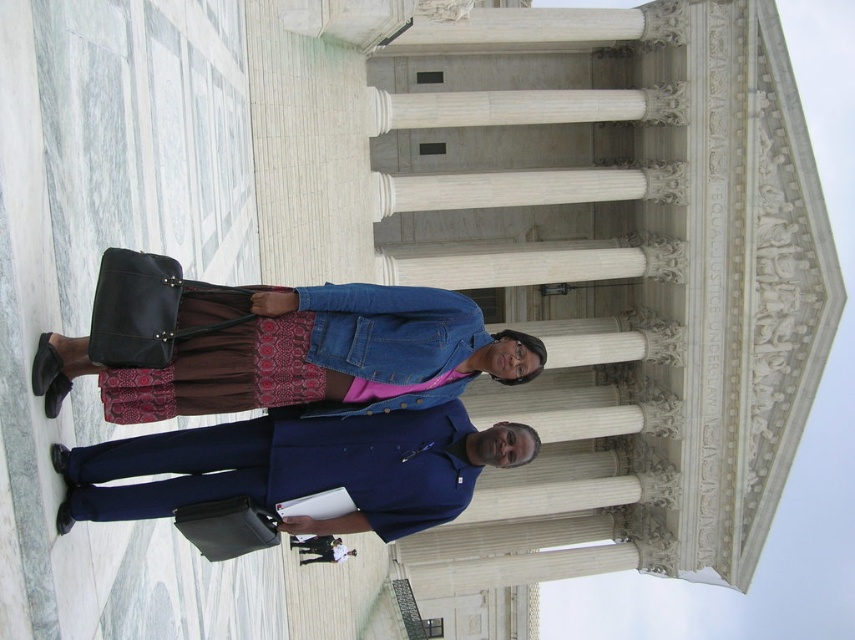
Consider the image. Can you confirm if denim jacket at center is thinner than dark blue shirt at center?

In fact, denim jacket at center might be wider than dark blue shirt at center.

Which is behind, point (497, 339) or point (305, 547)?

Positioned behind is point (305, 547).

Is point (276, 358) more distant than point (304, 560)?

No.

You are a GUI agent. You are given a task and a screenshot of the screen. Output one action in this format:
    pyautogui.click(x=<x>, y=<y>)
    Task: Click on the denim jacket at center
    This screenshot has height=640, width=855.
    Given the screenshot: What is the action you would take?
    pyautogui.click(x=301, y=355)

Is white marble columns at center shorter than dark blue shirt at center?

No, white marble columns at center is not shorter than dark blue shirt at center.

Who is taller, white marble columns at center or dark blue shirt at center?

With more height is white marble columns at center.

Describe the element at coordinates (546, 268) in the screenshot. I see `white marble columns at center` at that location.

Locate an element on the screen. The height and width of the screenshot is (640, 855). white marble columns at center is located at coordinates (546, 268).

Does white marble columns at center have a lesser width compared to blue woolen suit at center?

No, white marble columns at center is not thinner than blue woolen suit at center.

Does white marble columns at center appear on the left side of blue woolen suit at center?

In fact, white marble columns at center is to the right of blue woolen suit at center.

Where is `white marble columns at center`? white marble columns at center is located at coordinates (546, 268).